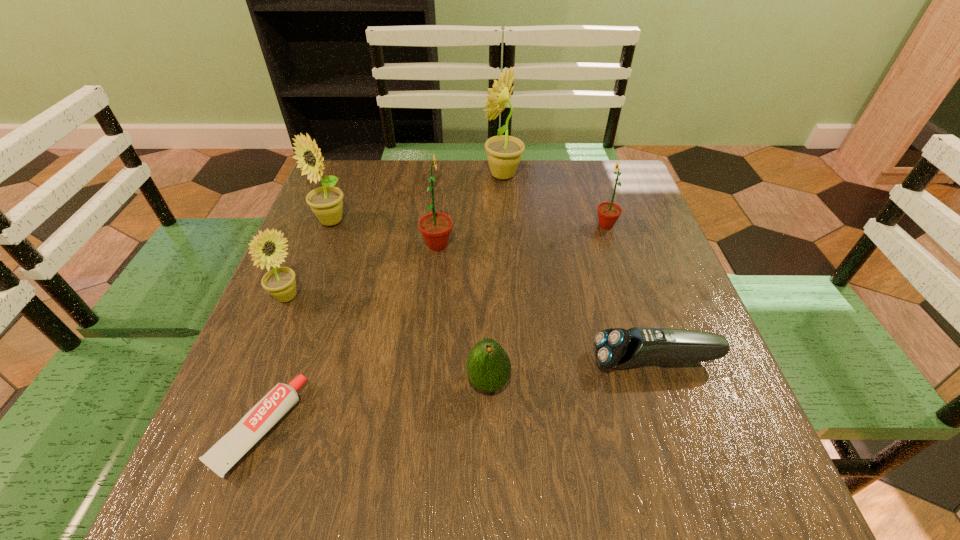
Locate an element on the screen. Image resolution: width=960 pixels, height=540 pixels. free region located 0.090m on the face of the right green sunflower is located at coordinates (558, 225).

Where is `free location located on the face of the right green sunflower`? The height and width of the screenshot is (540, 960). free location located on the face of the right green sunflower is located at coordinates (554, 225).

Locate an element on the screen. Image resolution: width=960 pixels, height=540 pixels. free space located on the front of the third shortest object is located at coordinates (489, 442).

I want to click on free space located on the head of the second shortest object, so click(436, 361).

Locate an element on the screen. This screenshot has height=540, width=960. free spot located 0.060m on the head of the second shortest object is located at coordinates pos(561,361).

Locate an element on the screen. The width and height of the screenshot is (960, 540). vacant point located on the head of the second shortest object is located at coordinates (485, 361).

At what (x,y) coordinates should I click in order to perform the action: click on free spot located on the right of the toothpaste. Please return your answer as a coordinate pair (x, y). The height and width of the screenshot is (540, 960). Looking at the image, I should click on pos(492,428).

At what (x,y) coordinates should I click in order to perform the action: click on object at the far edge. Please return your answer as a coordinate pair (x, y). The height and width of the screenshot is (540, 960). Looking at the image, I should click on (504, 152).

Find the location of a particular element. The height and width of the screenshot is (540, 960). object present at the near edge is located at coordinates coord(222,456).

Identify the location of toothpaste located at the left edge. The width and height of the screenshot is (960, 540). (222, 456).